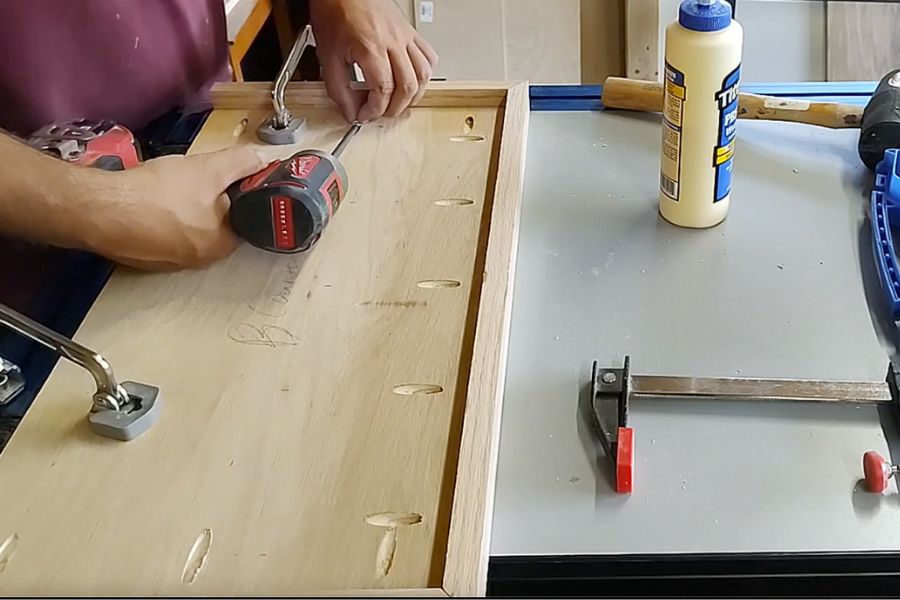
Locate an element on the screen. cabinet is located at coordinates (257, 30).